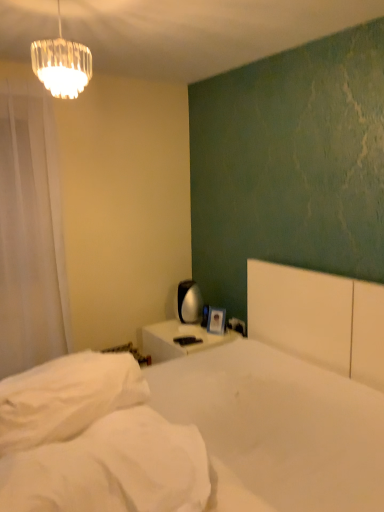
Question: Is white soft mattress at lower left looking in the opposite direction of white matte bed at center?

Choices:
 (A) no
 (B) yes

Answer: (B)

Question: From a real-world perspective, is white soft mattress at lower left located beneath white matte bed at center?

Choices:
 (A) yes
 (B) no

Answer: (B)

Question: Does white soft mattress at lower left have a greater height compared to white matte bed at center?

Choices:
 (A) no
 (B) yes

Answer: (A)

Question: Can you confirm if white soft mattress at lower left is bigger than white matte bed at center?

Choices:
 (A) no
 (B) yes

Answer: (A)

Question: Is white soft mattress at lower left positioned in front of white matte bed at center?

Choices:
 (A) no
 (B) yes

Answer: (A)

Question: Considering the relative sizes of white soft mattress at lower left and white matte bed at center in the image provided, is white soft mattress at lower left shorter than white matte bed at center?

Choices:
 (A) yes
 (B) no

Answer: (A)

Question: Can you confirm if white matte bed at center is shorter than clear glass chandelier at upper left?

Choices:
 (A) no
 (B) yes

Answer: (A)

Question: Is white matte bed at center positioned far away from clear glass chandelier at upper left?

Choices:
 (A) no
 (B) yes

Answer: (B)

Question: Is the depth of white matte bed at center greater than that of clear glass chandelier at upper left?

Choices:
 (A) yes
 (B) no

Answer: (B)

Question: Can you confirm if white matte bed at center is positioned to the right of clear glass chandelier at upper left?

Choices:
 (A) no
 (B) yes

Answer: (B)

Question: From a real-world perspective, is white matte bed at center located beneath clear glass chandelier at upper left?

Choices:
 (A) no
 (B) yes

Answer: (B)

Question: Considering the relative sizes of white matte bed at center and clear glass chandelier at upper left in the image provided, is white matte bed at center taller than clear glass chandelier at upper left?

Choices:
 (A) yes
 (B) no

Answer: (A)

Question: Can you confirm if clear glass chandelier at upper left is taller than white sheer curtain at left?

Choices:
 (A) yes
 (B) no

Answer: (B)